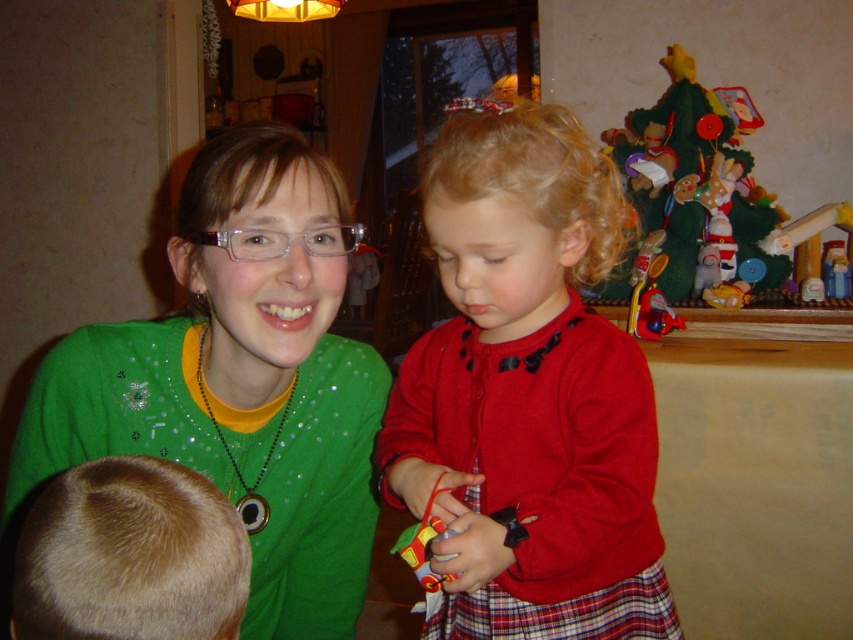
Can you confirm if blonde hair at lower left is bigger than clear plastic glasses at center?

Answer: No, blonde hair at lower left is not bigger than clear plastic glasses at center.

From the picture: Does blonde hair at lower left have a lesser width compared to clear plastic glasses at center?

Correct, blonde hair at lower left's width is less than clear plastic glasses at center's.

Between point (170, 557) and point (213, 243), which one is positioned in front?

Point (170, 557)

Where is `blonde hair at lower left`? The height and width of the screenshot is (640, 853). blonde hair at lower left is located at coordinates (129, 556).

The height and width of the screenshot is (640, 853). In order to click on felt christmas tree at upper right in this screenshot , I will do `click(698, 182)`.

Consider the image. Who is shorter, felt christmas tree at upper right or clear plastic glasses at center?

With less height is clear plastic glasses at center.

Find the location of `felt christmas tree at upper right`. felt christmas tree at upper right is located at coordinates (698, 182).

Is matte red sweater at center to the left of blonde hair at lower left from the viewer's perspective?

Incorrect, matte red sweater at center is not on the left side of blonde hair at lower left.

Which is more to the left, matte red sweater at center or blonde hair at lower left?

blonde hair at lower left

What do you see at coordinates (527, 392) in the screenshot? The image size is (853, 640). I see `matte red sweater at center` at bounding box center [527, 392].

The width and height of the screenshot is (853, 640). Identify the location of matte red sweater at center. (527, 392).